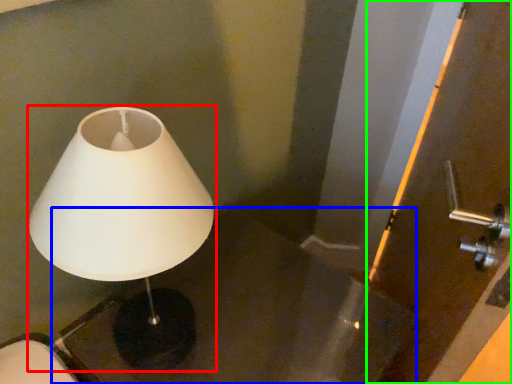
Question: Which object is the farthest from lamp (highlighted by a red box)? Choose among these: table (highlighted by a blue box) or screen door (highlighted by a green box).

Choices:
 (A) table
 (B) screen door

Answer: (B)